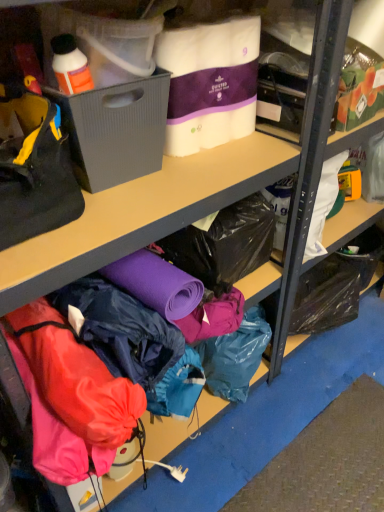
This screenshot has width=384, height=512. Identify the location of white quilted paper towels at upper center, the 2th clothing when ordered from bottom to top. (210, 83).

This screenshot has width=384, height=512. Identify the location of waterproof fabric jacket at lower center, positioned as the first clothing in bottom-to-top order. (70, 395).

Does waterproof fabric jacket at lower center, the 2th clothing when ordered from top to bottom, have a larger size compared to gray plastic bin at left?

Yes.

Considering the sizes of waterproof fabric jacket at lower center, positioned as the first clothing in bottom-to-top order, and gray plastic bin at left in the image, is waterproof fabric jacket at lower center, positioned as the first clothing in bottom-to-top order, taller or shorter than gray plastic bin at left?

Considering their sizes, waterproof fabric jacket at lower center, positioned as the first clothing in bottom-to-top order, has more height than gray plastic bin at left.

Are waterproof fabric jacket at lower center, the 2th clothing when ordered from top to bottom, and gray plastic bin at left beside each other?

waterproof fabric jacket at lower center, the 2th clothing when ordered from top to bottom, is not next to gray plastic bin at left, and they're not touching.

Does waterproof fabric jacket at lower center, the 2th clothing when ordered from top to bottom, appear on the right side of gray plastic bin at left?

In fact, waterproof fabric jacket at lower center, the 2th clothing when ordered from top to bottom, is to the left of gray plastic bin at left.

From a real-world perspective, is gray plastic bin at left on black fabric handbag at left?

No.

Is gray plastic bin at left shorter than black fabric handbag at left?

Yes, gray plastic bin at left is shorter than black fabric handbag at left.

Is point (80, 120) positioned before point (58, 213)?

No, (80, 120) is further to viewer.

At what (x,y) coordinates should I click in order to perform the action: click on clothing that appears on the right of waterproof fabric jacket at lower center, the 2th clothing when ordered from top to bottom. Please return your answer as a coordinate pair (x, y). This screenshot has height=512, width=384. Looking at the image, I should click on (210, 83).

Which object is wider, waterproof fabric jacket at lower center, positioned as the first clothing in bottom-to-top order, or white quilted paper towels at upper center, the 1th clothing when ordered from top to bottom?

Wider between the two is waterproof fabric jacket at lower center, positioned as the first clothing in bottom-to-top order.

Can you confirm if waterproof fabric jacket at lower center, the 2th clothing when ordered from top to bottom, is taller than white quilted paper towels at upper center, the 1th clothing when ordered from top to bottom?

Yes, waterproof fabric jacket at lower center, the 2th clothing when ordered from top to bottom, is taller than white quilted paper towels at upper center, the 1th clothing when ordered from top to bottom.

Considering the sizes of objects waterproof fabric jacket at lower center, the 2th clothing when ordered from top to bottom, and white quilted paper towels at upper center, the 1th clothing when ordered from top to bottom, in the image provided, who is bigger, waterproof fabric jacket at lower center, the 2th clothing when ordered from top to bottom, or white quilted paper towels at upper center, the 1th clothing when ordered from top to bottom,?

With larger size is waterproof fabric jacket at lower center, the 2th clothing when ordered from top to bottom.

Does waterproof fabric jacket at lower center, positioned as the first clothing in bottom-to-top order, contain black fabric handbag at left?

Definitely not — black fabric handbag at left is not inside waterproof fabric jacket at lower center, positioned as the first clothing in bottom-to-top order.

Is black fabric handbag at left at the back of waterproof fabric jacket at lower center, positioned as the first clothing in bottom-to-top order?

No, waterproof fabric jacket at lower center, positioned as the first clothing in bottom-to-top order, is not facing away from black fabric handbag at left.

Can you confirm if waterproof fabric jacket at lower center, the 2th clothing when ordered from top to bottom, is taller than black fabric handbag at left?

Correct, waterproof fabric jacket at lower center, the 2th clothing when ordered from top to bottom, is much taller as black fabric handbag at left.

From a real-world perspective, which is physically above, waterproof fabric jacket at lower center, the 2th clothing when ordered from top to bottom, or black fabric handbag at left?

In real-world perspective, black fabric handbag at left is above.

Is gray plastic bin at left looking in the opposite direction of waterproof fabric jacket at lower center, positioned as the first clothing in bottom-to-top order?

gray plastic bin at left does not have its back to waterproof fabric jacket at lower center, positioned as the first clothing in bottom-to-top order.

Can waterproof fabric jacket at lower center, the 2th clothing when ordered from top to bottom, be found inside gray plastic bin at left?

No, waterproof fabric jacket at lower center, the 2th clothing when ordered from top to bottom, is not a part of gray plastic bin at left.

Where is `box behind the waterproof fabric jacket at lower center, the 2th clothing when ordered from top to bottom`? box behind the waterproof fabric jacket at lower center, the 2th clothing when ordered from top to bottom is located at coordinates (115, 130).

Who is more distant, gray plastic bin at left or waterproof fabric jacket at lower center, positioned as the first clothing in bottom-to-top order?

Positioned behind is gray plastic bin at left.

Which object is positioned more to the left, white quilted paper towels at upper center, the 2th clothing when ordered from bottom to top, or gray plastic bin at left?

gray plastic bin at left is more to the left.

In the scene shown: From a real-world perspective, is white quilted paper towels at upper center, the 1th clothing when ordered from top to bottom, above or below gray plastic bin at left?

white quilted paper towels at upper center, the 1th clothing when ordered from top to bottom, is above gray plastic bin at left.

Is white quilted paper towels at upper center, the 1th clothing when ordered from top to bottom, thinner than gray plastic bin at left?

Yes, white quilted paper towels at upper center, the 1th clothing when ordered from top to bottom, is thinner than gray plastic bin at left.

Can you tell me how much white quilted paper towels at upper center, the 1th clothing when ordered from top to bottom, and gray plastic bin at left differ in facing direction?

white quilted paper towels at upper center, the 1th clothing when ordered from top to bottom, and gray plastic bin at left are facing 0.226 degrees away from each other.

Image resolution: width=384 pixels, height=512 pixels. I want to click on clothing above the gray plastic bin at left (from the image's perspective), so (x=210, y=83).

From a real-world perspective, is gray plastic bin at left on white quilted paper towels at upper center, the 1th clothing when ordered from top to bottom?

No, from a real-world perspective, gray plastic bin at left is not on top of white quilted paper towels at upper center, the 1th clothing when ordered from top to bottom.

Is gray plastic bin at left oriented towards white quilted paper towels at upper center, the 1th clothing when ordered from top to bottom?

No.

Does gray plastic bin at left have a greater width compared to white quilted paper towels at upper center, the 2th clothing when ordered from bottom to top?

Yes, gray plastic bin at left is wider than white quilted paper towels at upper center, the 2th clothing when ordered from bottom to top.

The width and height of the screenshot is (384, 512). I want to click on clothing on the left of gray plastic bin at left, so click(x=70, y=395).

This screenshot has height=512, width=384. In order to click on box below the black fabric handbag at left (from a real-world perspective) in this screenshot , I will do `click(115, 130)`.

Estimate the real-world distances between objects in this image. Which object is closer to black fabric handbag at left, gray plastic bin at left or white quilted paper towels at upper center, the 2th clothing when ordered from bottom to top?

gray plastic bin at left is closer to black fabric handbag at left.

Which object lies nearer to the anchor point white quilted paper towels at upper center, the 2th clothing when ordered from bottom to top, gray plastic bin at left or black fabric handbag at left?

gray plastic bin at left is closer to white quilted paper towels at upper center, the 2th clothing when ordered from bottom to top.

Estimate the real-world distances between objects in this image. Which object is closer to gray plastic bin at left, black fabric handbag at left or waterproof fabric jacket at lower center, the 2th clothing when ordered from top to bottom?

black fabric handbag at left is closer to gray plastic bin at left.

Which object lies further to the anchor point waterproof fabric jacket at lower center, the 2th clothing when ordered from top to bottom, black fabric handbag at left or gray plastic bin at left?

gray plastic bin at left lies further to waterproof fabric jacket at lower center, the 2th clothing when ordered from top to bottom, than the other object.

In the scene shown: When comparing their distances from white quilted paper towels at upper center, the 1th clothing when ordered from top to bottom, does waterproof fabric jacket at lower center, the 2th clothing when ordered from top to bottom, or gray plastic bin at left seem closer?

gray plastic bin at left.

Based on their spatial positions, is white quilted paper towels at upper center, the 2th clothing when ordered from bottom to top, or gray plastic bin at left further from black fabric handbag at left?

Based on the image, white quilted paper towels at upper center, the 2th clothing when ordered from bottom to top, appears to be further to black fabric handbag at left.

Considering their positions, is black fabric handbag at left positioned further to waterproof fabric jacket at lower center, the 2th clothing when ordered from top to bottom, than white quilted paper towels at upper center, the 1th clothing when ordered from top to bottom?

Based on the image, white quilted paper towels at upper center, the 1th clothing when ordered from top to bottom, appears to be further to waterproof fabric jacket at lower center, the 2th clothing when ordered from top to bottom.

Considering their positions, is white quilted paper towels at upper center, the 1th clothing when ordered from top to bottom, positioned further to gray plastic bin at left than waterproof fabric jacket at lower center, positioned as the first clothing in bottom-to-top order?

Based on the image, waterproof fabric jacket at lower center, positioned as the first clothing in bottom-to-top order, appears to be further to gray plastic bin at left.

You are a GUI agent. You are given a task and a screenshot of the screen. Output one action in this format:
    pyautogui.click(x=<x>, y=<y>)
    Task: Click on the handbag between gray plastic bin at left and waterproof fabric jacket at lower center, the 2th clothing when ordered from top to bottom, in the vertical direction
    The height and width of the screenshot is (512, 384).
    Given the screenshot: What is the action you would take?
    pyautogui.click(x=35, y=172)

Locate an element on the screen. This screenshot has width=384, height=512. box between black fabric handbag at left and white quilted paper towels at upper center, the 2th clothing when ordered from bottom to top is located at coordinates coord(115,130).

The image size is (384, 512). What are the coordinates of `handbag between white quilted paper towels at upper center, the 1th clothing when ordered from top to bottom, and waterproof fabric jacket at lower center, the 2th clothing when ordered from top to bottom, vertically` in the screenshot? It's located at (35, 172).

Locate an element on the screen. The width and height of the screenshot is (384, 512). box between white quilted paper towels at upper center, the 1th clothing when ordered from top to bottom, and waterproof fabric jacket at lower center, the 2th clothing when ordered from top to bottom, from top to bottom is located at coordinates (115, 130).